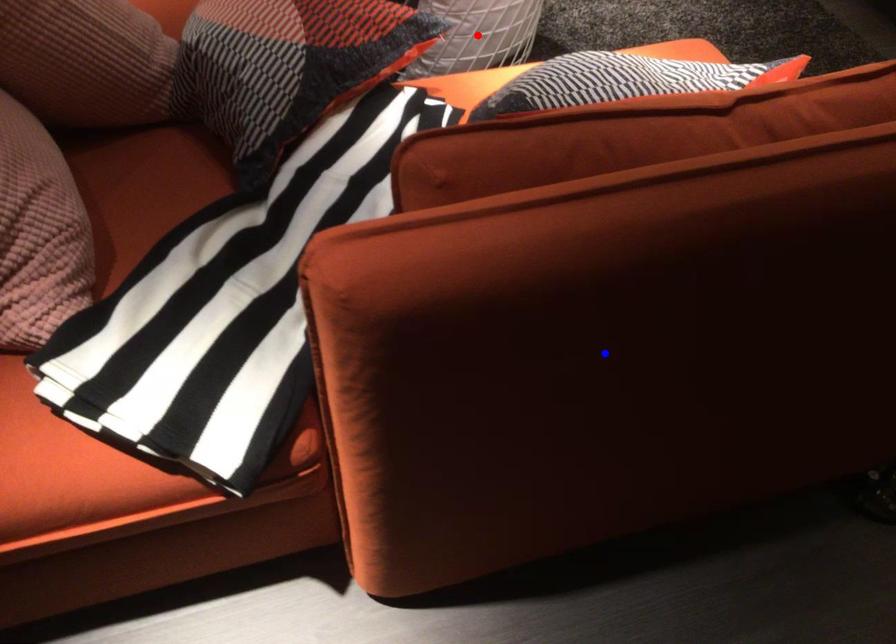
Question: In the image, two points are highlighted. Which point is nearer to the camera? Reply with the corresponding letter.

Choices:
 (A) blue point
 (B) red point

Answer: (A)